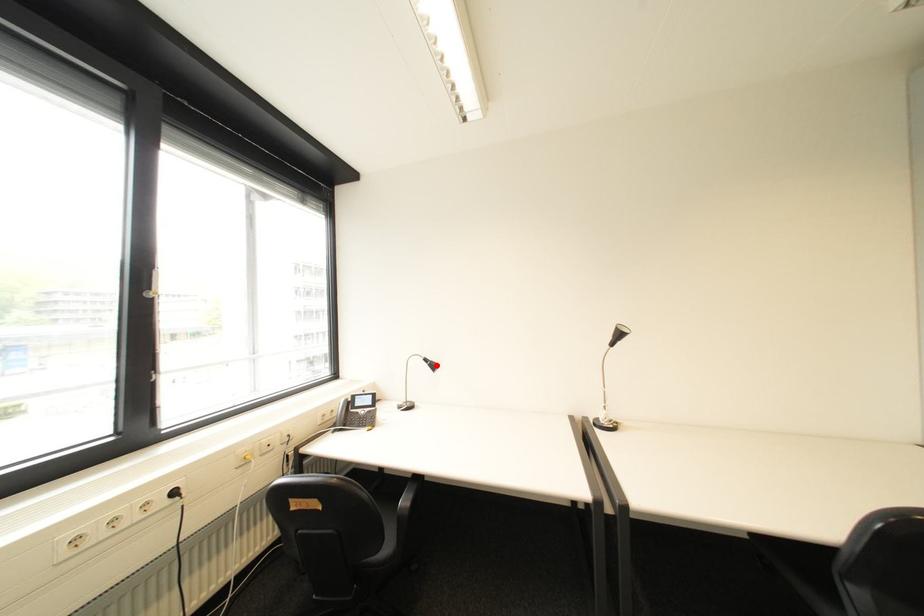
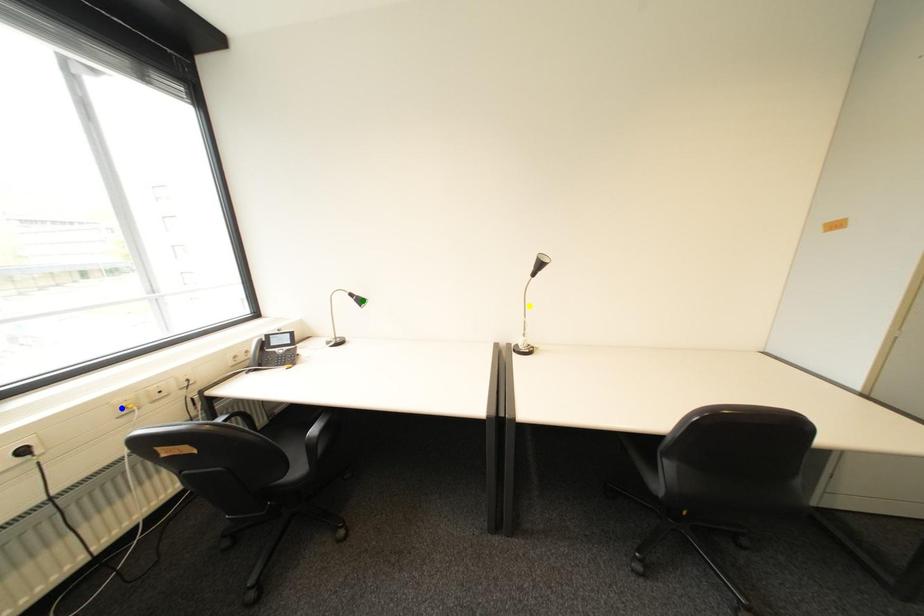
Question: I am providing you with two images of the same scene from different viewpoints. A red point is marked on the first image. You are given multiple points on the second image. Which spot in image 2 lines up with the point in image 1?

Choices:
 (A) green point
 (B) yellow point
 (C) blue point

Answer: (A)